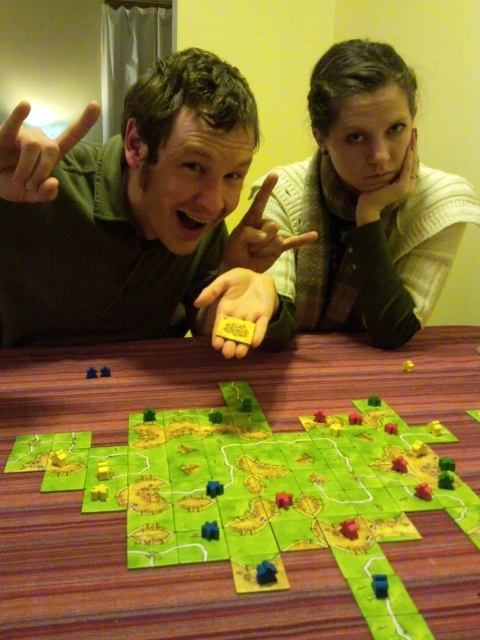
You are a player in the board game and need to place your new token on the board. The new token is exactly the same width as the green paper map at center. Can you place it on the space where the matte yellow token at center is currently located?

The matte yellow token at center might be wider than the green paper map at center. Since the new token has the same width as the green paper map at center, it might not fit in the space occupied by the matte yellow token at center because the existing token could be wider.

You are playing a board game and need to place a new token. The game rules state that the new token must be placed to the right of the green paper map at center. Can the matte yellow token at center be used for this placement?

The matte yellow token at center is currently to the left of the green paper map at center, so placing it to the right of the green paper map at center would require moving it. Since the question is about using the existing placement, the matte yellow token at center cannot be used for this placement as it is not already to the right of the green paper map at center.